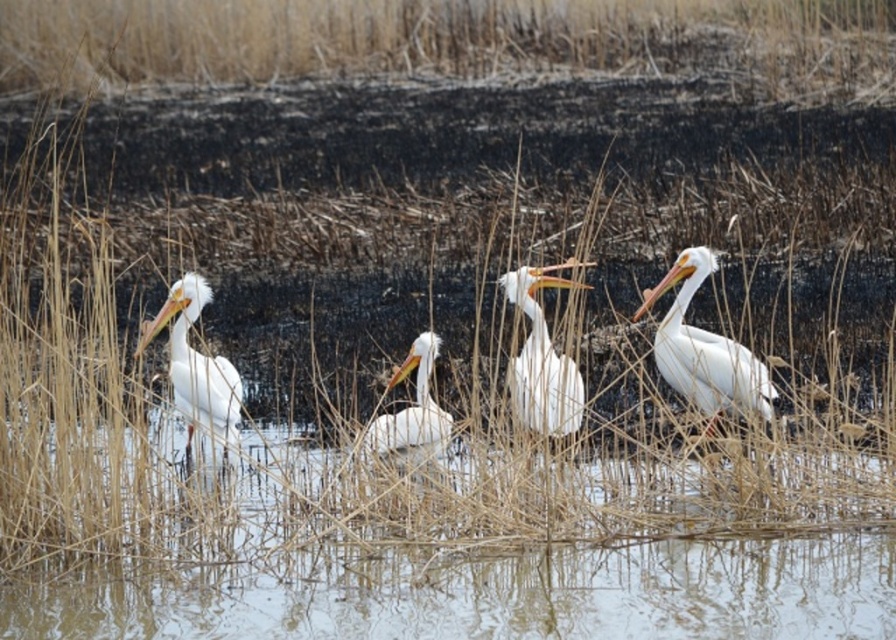
Who is shorter, white matte pelican at right or white smooth pelican at center?

white smooth pelican at center

The height and width of the screenshot is (640, 896). What do you see at coordinates (704, 349) in the screenshot?
I see `white matte pelican at right` at bounding box center [704, 349].

Which is behind, point (721, 371) or point (524, 422)?

The point (721, 371) is more distant.

At what (x,y) coordinates should I click in order to perform the action: click on white matte pelican at right. Please return your answer as a coordinate pair (x, y). Looking at the image, I should click on (704, 349).

Can you confirm if clear water at lower center is positioned above white matte pelican at right?

Incorrect, clear water at lower center is not positioned above white matte pelican at right.

Is clear water at lower center shorter than white matte pelican at right?

Yes.

The image size is (896, 640). What are the coordinates of `clear water at lower center` in the screenshot? It's located at (490, 595).

Which is more to the left, white matte pelican at left or white matte pelican at center?

white matte pelican at left

Is white matte pelican at left to the right of white matte pelican at center from the viewer's perspective?

Incorrect, white matte pelican at left is not on the right side of white matte pelican at center.

Does point (143, 321) lie behind point (424, 374)?

That is True.

Identify the location of white matte pelican at left. (195, 364).